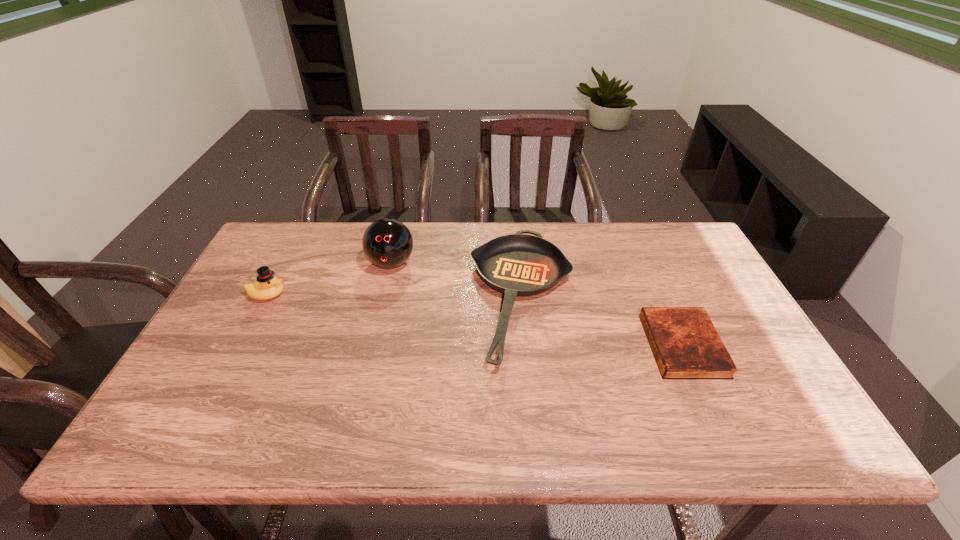
This screenshot has width=960, height=540. Find the location of `vacant region at the right edge`. vacant region at the right edge is located at coordinates (777, 384).

At what (x,y) coordinates should I click in order to perform the action: click on free space at the far left corner of the desktop. Please return your answer as a coordinate pair (x, y). The image size is (960, 540). Looking at the image, I should click on (274, 256).

Locate an element on the screen. The height and width of the screenshot is (540, 960). free space at the far right corner of the desktop is located at coordinates (668, 241).

Identify the location of free space between the frying pan and the third object from right to left. Image resolution: width=960 pixels, height=540 pixels. (457, 280).

Find the location of a particular element. The height and width of the screenshot is (540, 960). free space between the third object from right to left and the shortest object is located at coordinates (537, 305).

Find the location of `vacant space that is in between the third object from right to left and the third shortest object`. vacant space that is in between the third object from right to left and the third shortest object is located at coordinates (329, 279).

Locate an element on the screen. The width and height of the screenshot is (960, 540). empty space between the rightmost object and the frying pan is located at coordinates (603, 321).

This screenshot has height=540, width=960. What are the coordinates of `vacant region between the tallest object and the second shortest object` in the screenshot? It's located at (457, 280).

Identify the location of unoccupied area between the shortest object and the third object from left to right. point(603,321).

This screenshot has width=960, height=540. Identify the location of free area in between the frying pan and the shortest object. (603, 321).